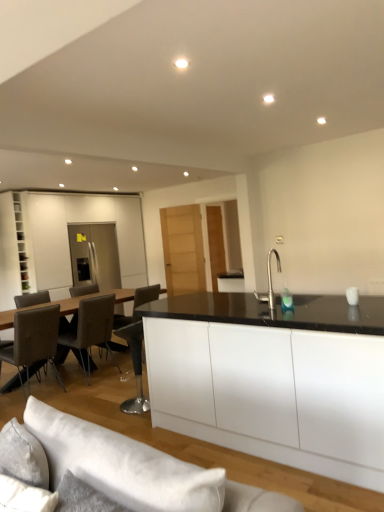
Question: Considering the positions of leather at left, acting as the 2th chair starting from the right, and leather/chrome chair at left, which is the 1th chair in left-to-right order, in the image, is leather at left, acting as the 2th chair starting from the right, wider or thinner than leather/chrome chair at left, which is the 1th chair in left-to-right order,?

Choices:
 (A) thin
 (B) wide

Answer: (B)

Question: Is leather at left, acting as the 2th chair starting from the right, inside or outside of leather/chrome chair at left, which is the third chair from right to left?

Choices:
 (A) inside
 (B) outside

Answer: (B)

Question: Estimate the real-world distances between objects in this image. Which object is closer to the leather/chrome chair at left, which is the third chair from right to left?

Choices:
 (A) leather bar stool at center, positioned as the third chair in left-to-right order
 (B) leather at left, which is the second chair from left to right
 (C) satin silver refrigerator at left
 (D) white matte cabinet at left
 (E) white fabric couch at lower center

Answer: (B)

Question: Estimate the real-world distances between objects in this image. Which object is closer to the satin silver refrigerator at left?

Choices:
 (A) leather bar stool at center, the 1th chair in the right-to-left sequence
 (B) leather at left, acting as the 2th chair starting from the right
 (C) white matte cabinet at left
 (D) leather/chrome chair at left, which is the 1th chair in left-to-right order
 (E) white fabric couch at lower center

Answer: (C)